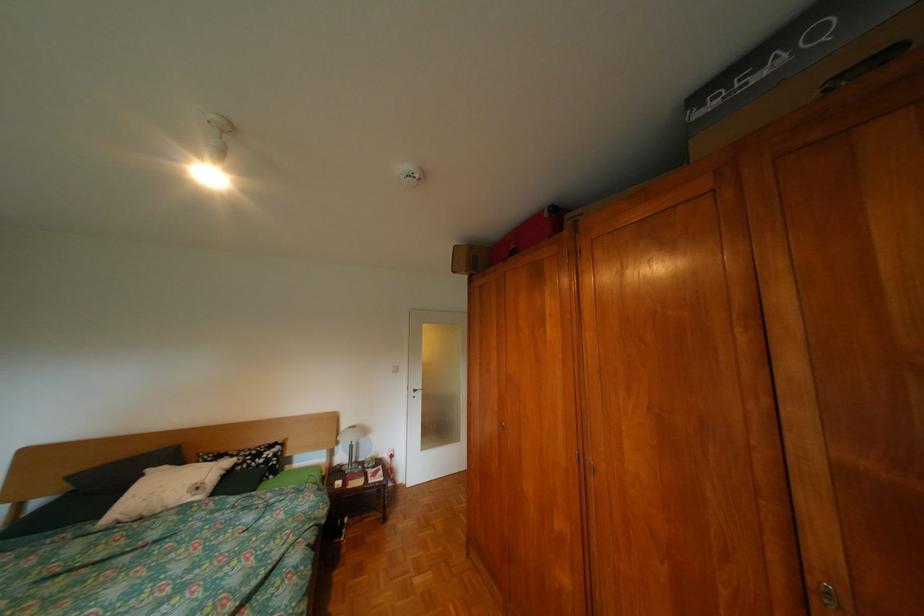
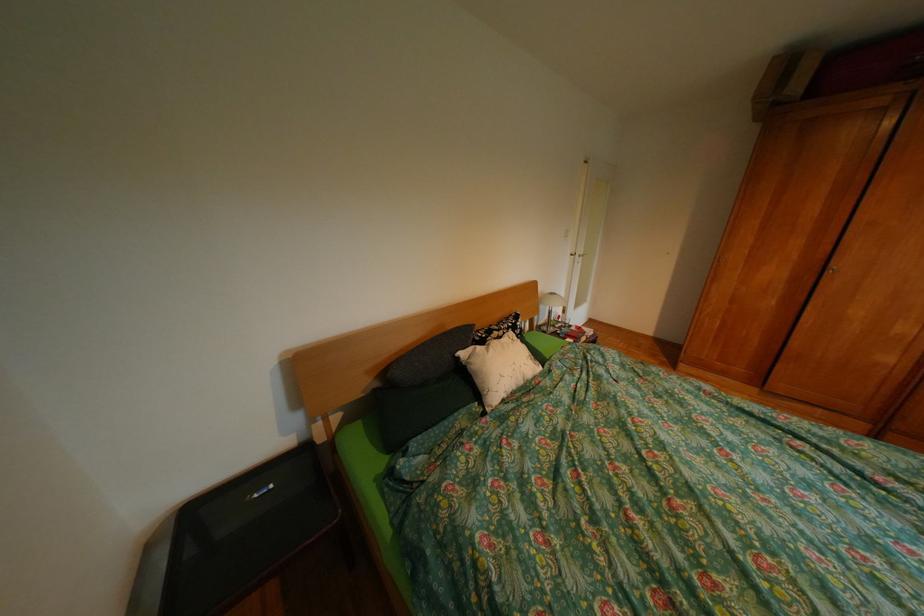
Where in the second image is the point corresponding to (162,471) from the first image?

(477, 354)